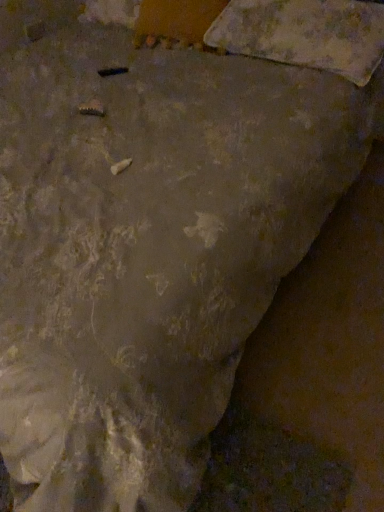
Image resolution: width=384 pixels, height=512 pixels. Describe the element at coordinates (304, 34) in the screenshot. I see `camouflage fabric pillow at upper right` at that location.

Find the location of `camouflage fabric pillow at upper right`. camouflage fabric pillow at upper right is located at coordinates (304, 34).

I want to click on camouflage fabric pillow at upper right, so click(x=304, y=34).